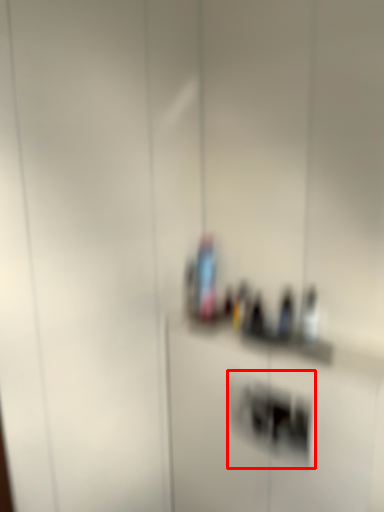
Question: From the image's perspective, what is the correct spatial positioning of light switch (annotated by the red box) in reference to bottle?

Choices:
 (A) below
 (B) above

Answer: (A)